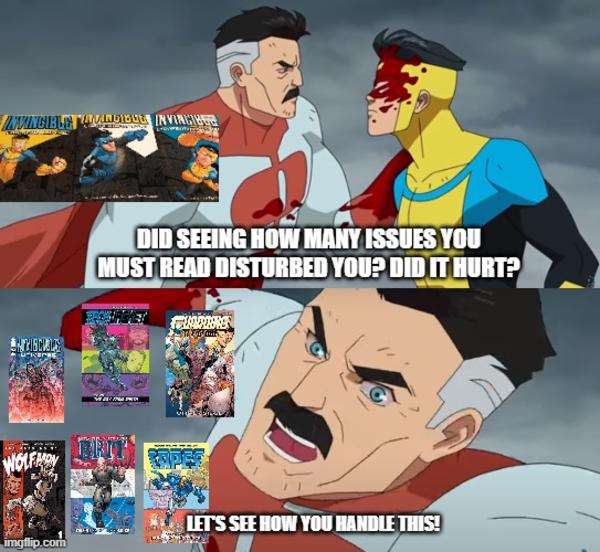
Locate an element on the screen. chest is located at coordinates click(x=259, y=174).